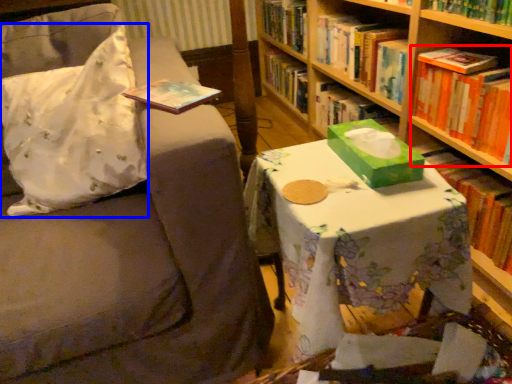
Question: Which of the following is the closest to the observer, book (highlighted by a red box) or throw pillow (highlighted by a blue box)?

Choices:
 (A) book
 (B) throw pillow

Answer: (B)